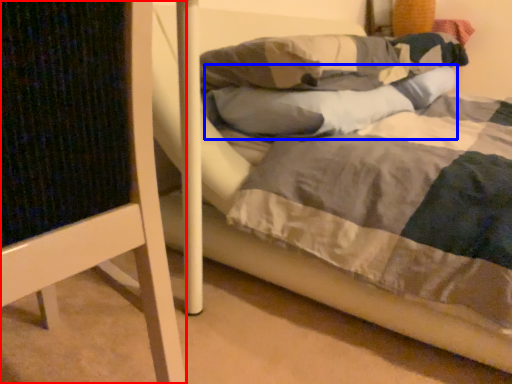
Question: Among these objects, which one is farthest to the camera, furniture (highlighted by a red box) or pillow (highlighted by a blue box)?

Choices:
 (A) furniture
 (B) pillow

Answer: (B)